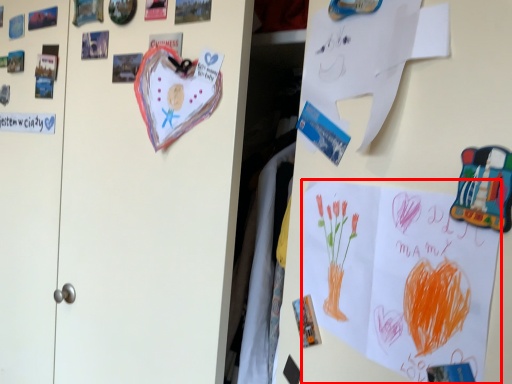
Question: Considering the relative positions of poster (annotated by the red box) and paper in the image provided, where is poster (annotated by the red box) located with respect to the staircase?

Choices:
 (A) right
 (B) left

Answer: (A)